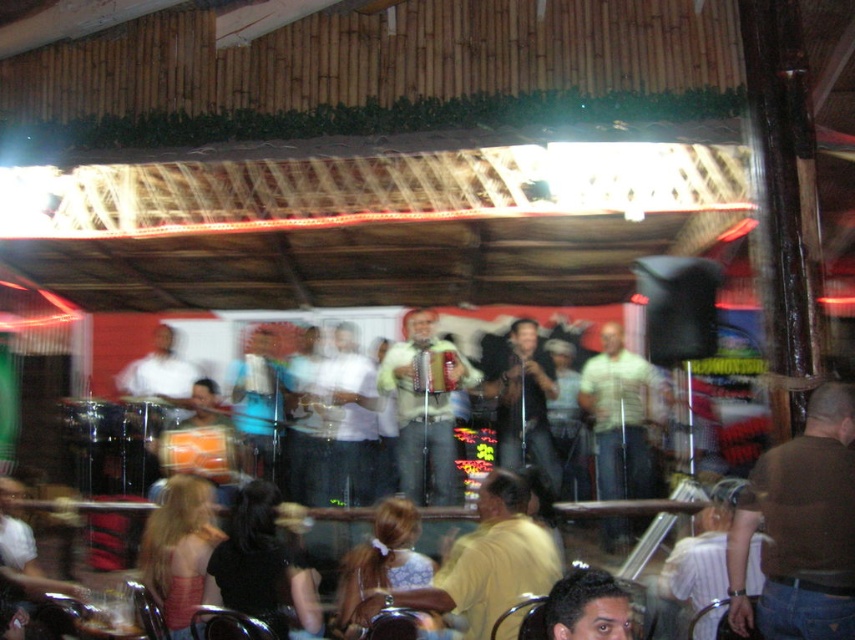
The width and height of the screenshot is (855, 640). What do you see at coordinates (346, 420) in the screenshot?
I see `white matte shirt at center` at bounding box center [346, 420].

Can you confirm if white matte shirt at center is positioned below matte black shirt at center?

Incorrect, white matte shirt at center is not positioned below matte black shirt at center.

Is point (329, 476) in front of point (522, 340)?

That is True.

Where is `white matte shirt at center`? white matte shirt at center is located at coordinates (346, 420).

Is light green shirt at center to the right of light brown leather accordion at center from the viewer's perspective?

Yes, light green shirt at center is to the right of light brown leather accordion at center.

How distant is light green shirt at center from light brown leather accordion at center?

light green shirt at center is 3.35 feet from light brown leather accordion at center.

Is point (649, 440) closer to viewer compared to point (407, 392)?

No, it is not.

Locate an element on the screen. This screenshot has width=855, height=640. light green shirt at center is located at coordinates (622, 417).

Who is positioned more to the left, light green shirt at center or white matte shirt at center?

white matte shirt at center

Which of these two, light green shirt at center or white matte shirt at center, stands shorter?

With less height is light green shirt at center.

Is point (631, 461) behind point (360, 454)?

No, (631, 461) is in front of (360, 454).

Identify the location of light green shirt at center. (622, 417).